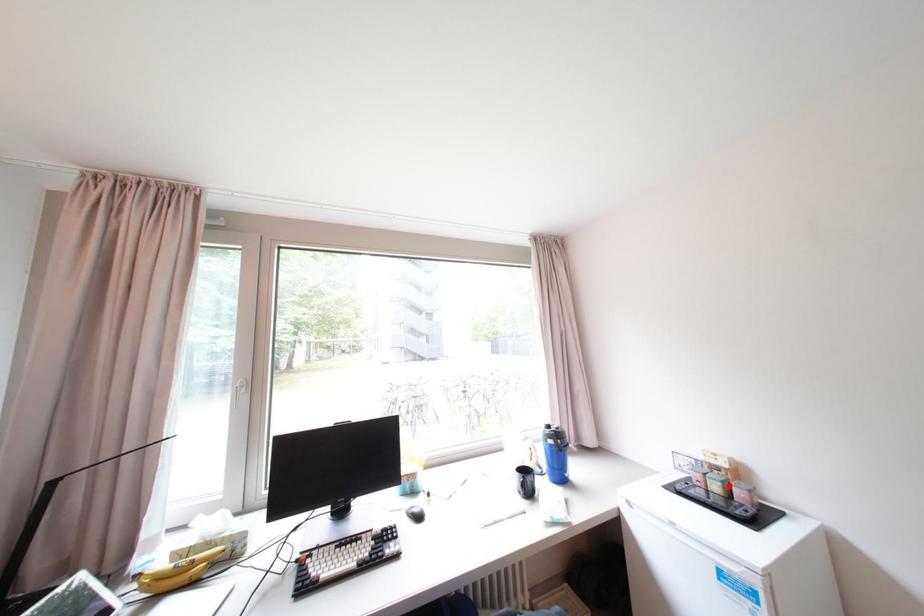
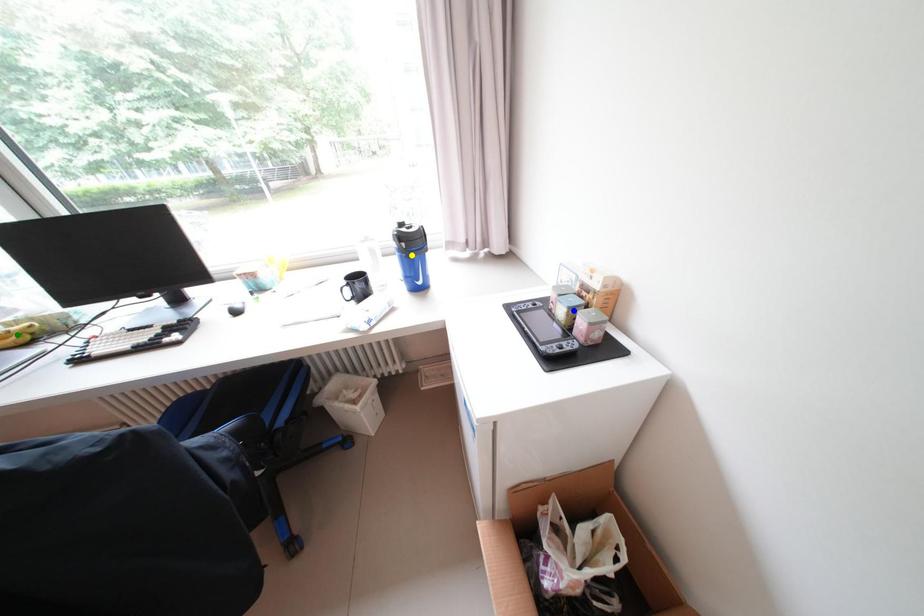
Question: I am providing you with two images of the same scene from different viewpoints. A red point is marked on the first image. You are given multiple points on the second image. Can you choose the point in image 2 that corresponds to the point in image 1?

Choices:
 (A) green point
 (B) yellow point
 (C) blue point

Answer: (C)